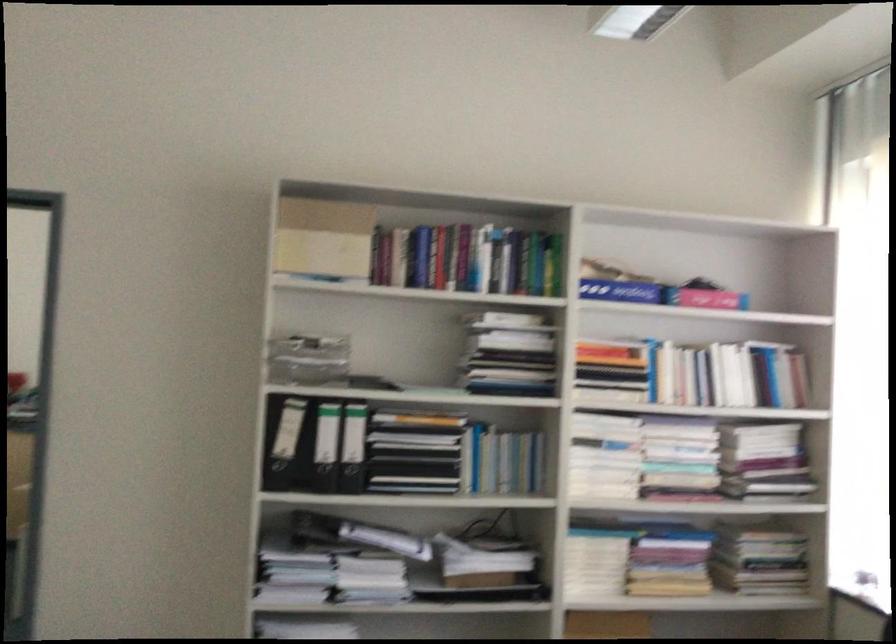
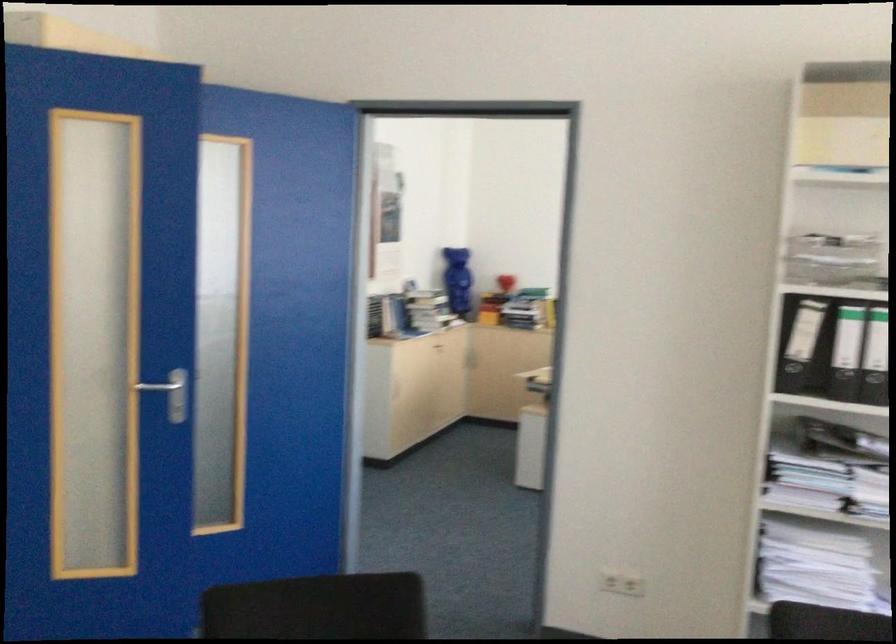
The point at (334, 450) is marked in the first image. Where is the corresponding point in the second image?

(858, 355)